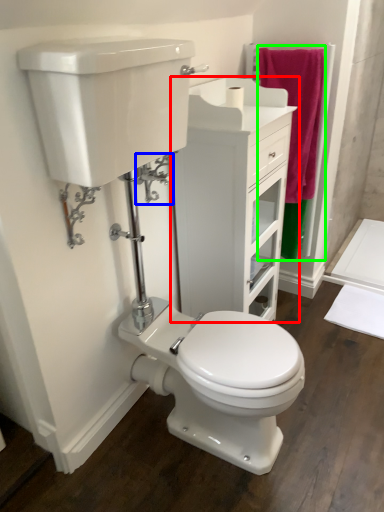
Question: Estimate the real-world distances between objects in this image. Which object is closer to bathroom cabinet (highlighted by a red box), plumbing fixture (highlighted by a blue box) or bath towel (highlighted by a green box)?

Choices:
 (A) plumbing fixture
 (B) bath towel

Answer: (B)